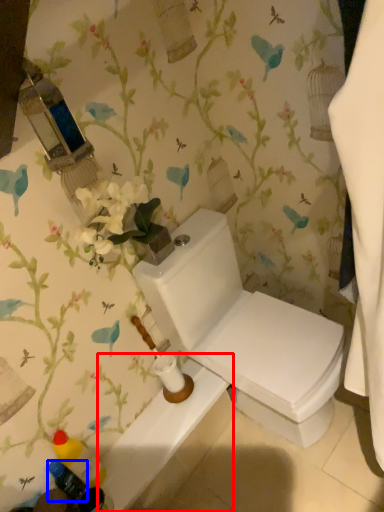
Question: Which of the following is the farthest to the observer, bath (highlighted by a red box) or toiletry (highlighted by a blue box)?

Choices:
 (A) bath
 (B) toiletry

Answer: (A)